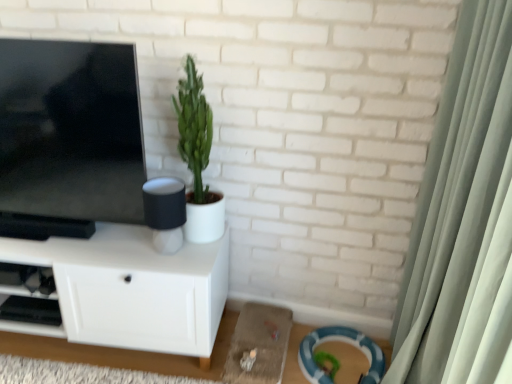
You are a GUI agent. You are given a task and a screenshot of the screen. Output one action in this format:
    pyautogui.click(x=<x>, y=<y>)
    Task: Click on the vacant region below matte black tv at left (from a real-world perspective)
    This screenshot has width=512, height=384.
    Given the screenshot: What is the action you would take?
    pyautogui.click(x=71, y=238)